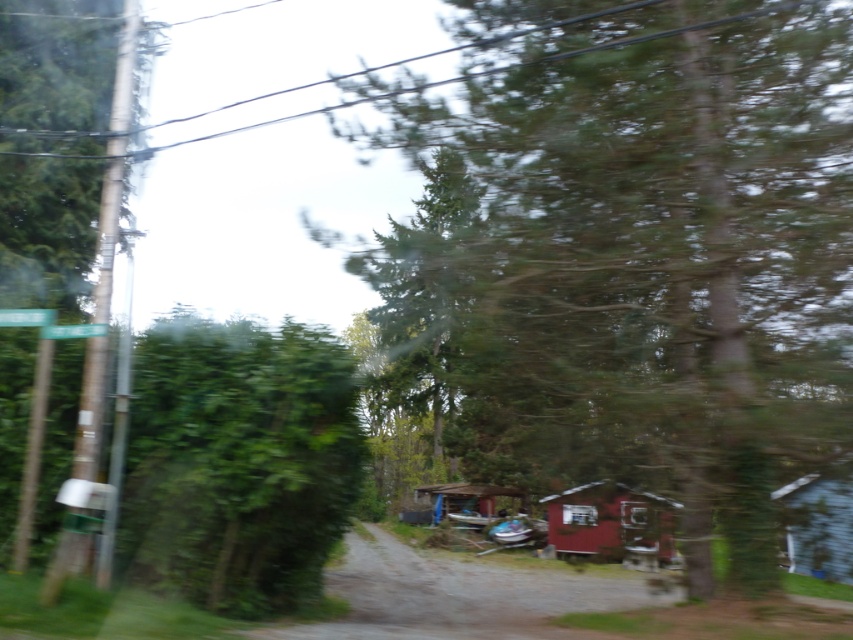
You are a passenger in a car driving along a dirt road in a forest. You notice a wooden cabin at center and a transparent glass car window at center. Which object is wider from your viewpoint?

The wooden cabin at center is wider than the transparent glass car window at center.

You are a drone operator trying to fly a drone between the wooden cabin at right and the metallic silver power line at upper center. The drone has a safety distance requirement of 10 meters to avoid collisions. Can you safely navigate the drone through this gap?

The wooden cabin at right is 11.14 meters away from the metallic silver power line at upper center. Since the required safety distance is 10 meters, the gap is sufficient, so yes, you can safely navigate the drone through this gap.